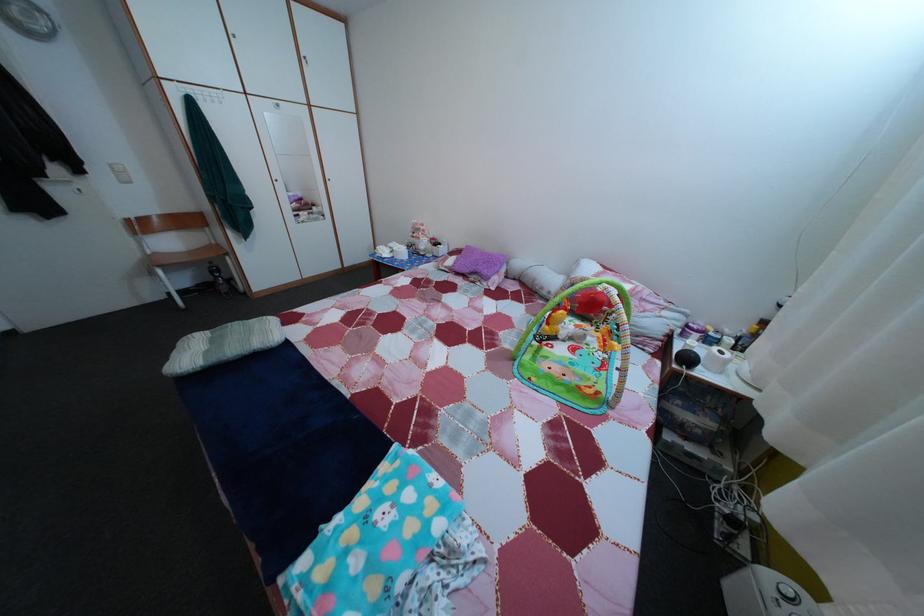
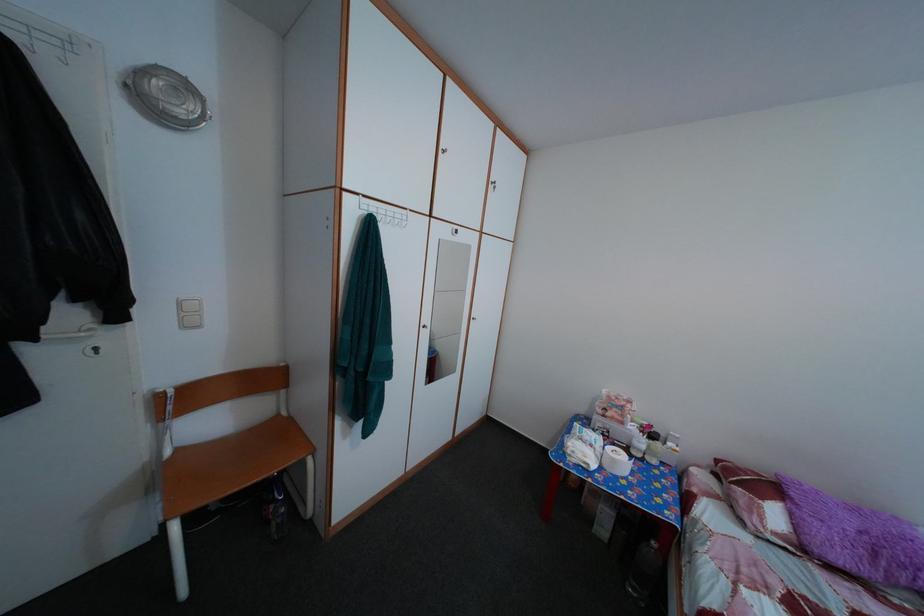
The images are taken continuously from a first-person perspective. In which direction are you moving?

The movement direction of the cameraman is left, forward.